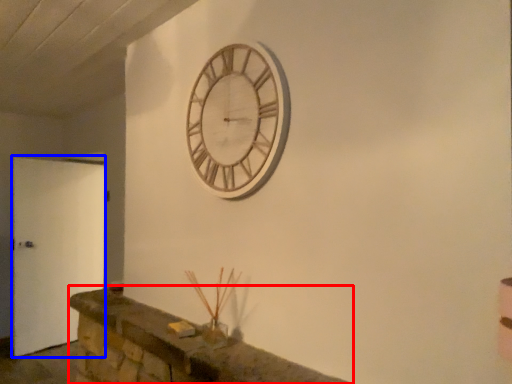
Question: Which of the following is the farthest to the observer, mantle (highlighted by a red box) or door (highlighted by a blue box)?

Choices:
 (A) mantle
 (B) door

Answer: (B)